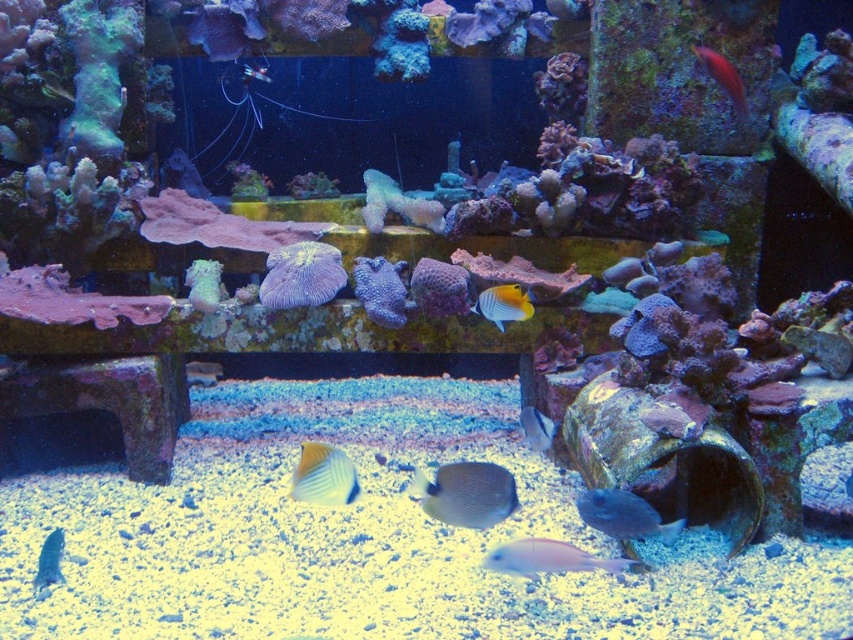
Question: Is blue glossy fish at lower center in front of matte silver fish at center?

Choices:
 (A) no
 (B) yes

Answer: (B)

Question: Which of the following is the farthest from the observer?

Choices:
 (A) (57, 580)
 (B) (540, 444)

Answer: (B)

Question: Which point is farther from the camera taking this photo?

Choices:
 (A) (601, 512)
 (B) (535, 561)
 (C) (438, 476)

Answer: (A)

Question: Does gray matte fish at center have a smaller size compared to white glossy fish at lower center?

Choices:
 (A) yes
 (B) no

Answer: (A)

Question: From the image, what is the correct spatial relationship of shiny pink fish at upper right in relation to matte silver fish at center?

Choices:
 (A) right
 (B) left

Answer: (A)

Question: Which of these objects is positioned farthest from the matte silver fish at center?

Choices:
 (A) shiny pink fish at upper right
 (B) white coral at center

Answer: (A)